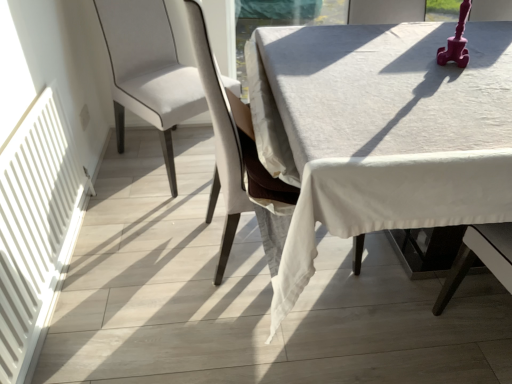
Question: Does white fabric chair at center, the 1th chair in the right-to-left sequence, appear on the right side of white linen table at center?

Choices:
 (A) no
 (B) yes

Answer: (A)

Question: Could you tell me if white fabric chair at center, the 2th chair in the left-to-right sequence, is facing white linen table at center?

Choices:
 (A) no
 (B) yes

Answer: (B)

Question: Is white linen table at center at the back of white fabric chair at center, the 1th chair in the right-to-left sequence?

Choices:
 (A) yes
 (B) no

Answer: (B)

Question: From a real-world perspective, is white fabric chair at center, the 2th chair in the left-to-right sequence, on top of white linen table at center?

Choices:
 (A) no
 (B) yes

Answer: (B)

Question: Can you confirm if white fabric chair at center, the 1th chair in the right-to-left sequence, is taller than white linen table at center?

Choices:
 (A) no
 (B) yes

Answer: (B)

Question: Considering the relative positions of white matte radiator at left and white fabric chair at center, the 2th chair in the left-to-right sequence, in the image provided, is white matte radiator at left to the left or to the right of white fabric chair at center, the 2th chair in the left-to-right sequence,?

Choices:
 (A) right
 (B) left

Answer: (B)

Question: Is white matte radiator at left spatially inside white fabric chair at center, the 1th chair in the right-to-left sequence, or outside of it?

Choices:
 (A) outside
 (B) inside

Answer: (A)

Question: Is white matte radiator at left in front of or behind white fabric chair at center, the 2th chair in the left-to-right sequence, in the image?

Choices:
 (A) front
 (B) behind

Answer: (A)

Question: From the image's perspective, relative to white fabric chair at center, the 2th chair in the left-to-right sequence, is white matte radiator at left above or below?

Choices:
 (A) above
 (B) below

Answer: (B)

Question: Relative to satin white chair at center, which is the 2th chair in right-to-left order, is white fabric chair at center, the 2th chair in the left-to-right sequence, in front or behind?

Choices:
 (A) behind
 (B) front

Answer: (B)

Question: Do you think white fabric chair at center, the 2th chair in the left-to-right sequence, is within satin white chair at center, which is the 1th chair in left-to-right order, or outside of it?

Choices:
 (A) inside
 (B) outside

Answer: (B)

Question: From the image's perspective, relative to satin white chair at center, which is the 1th chair in left-to-right order, is white fabric chair at center, the 1th chair in the right-to-left sequence, above or below?

Choices:
 (A) above
 (B) below

Answer: (B)

Question: Is point (238, 147) closer or farther from the camera than point (201, 89)?

Choices:
 (A) closer
 (B) farther

Answer: (A)

Question: Is point (7, 238) closer or farther from the camera than point (267, 97)?

Choices:
 (A) closer
 (B) farther

Answer: (A)

Question: From the image's perspective, is white matte radiator at left above or below white linen table at center?

Choices:
 (A) below
 (B) above

Answer: (A)